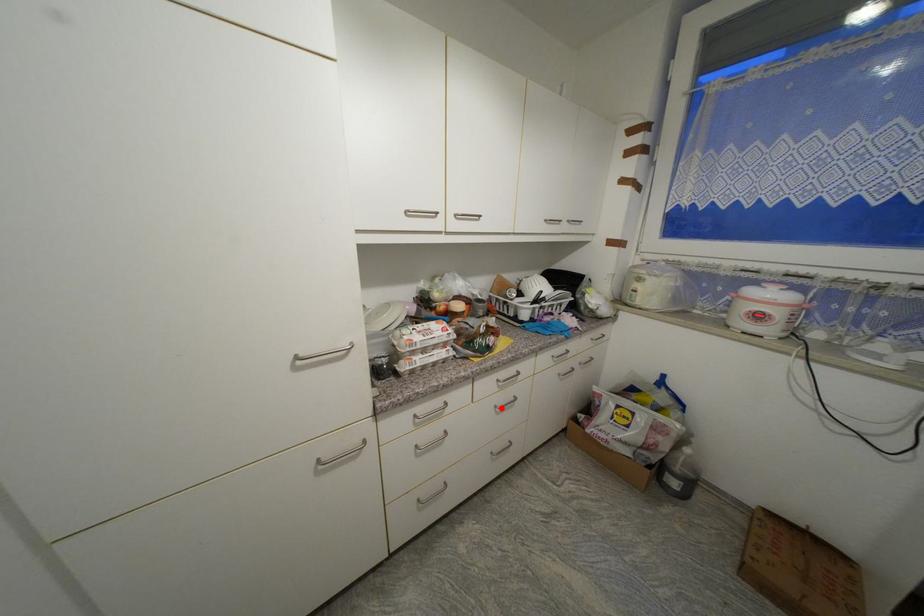
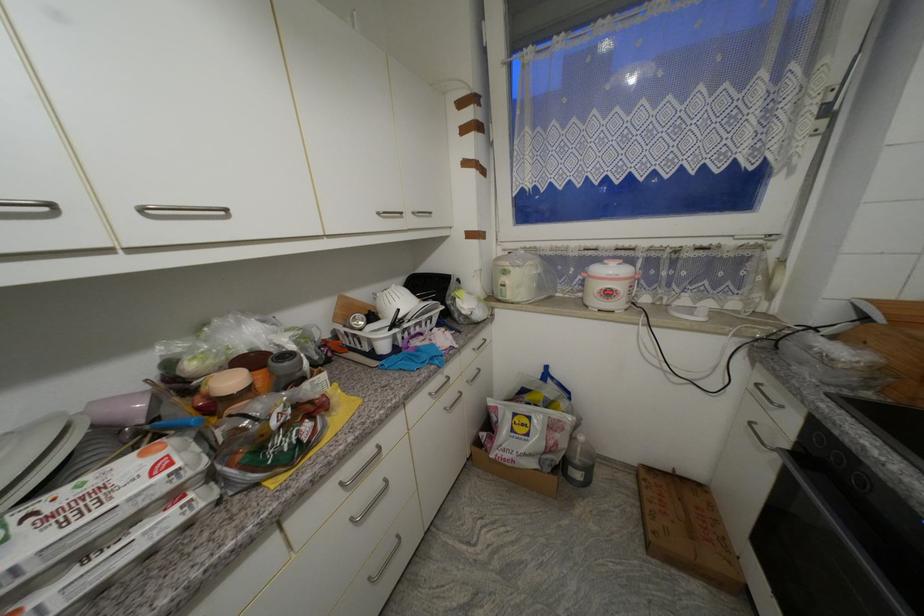
Find the pixel in the second image that matches the highlighted location in the first image.

(358, 521)